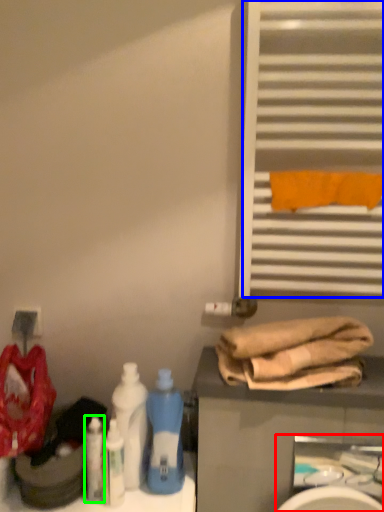
Question: Considering the real-world distances, which object is farthest from sink (highlighted by a red box)? shutter (highlighted by a blue box) or cleaning product (highlighted by a green box)?

Choices:
 (A) shutter
 (B) cleaning product

Answer: (B)